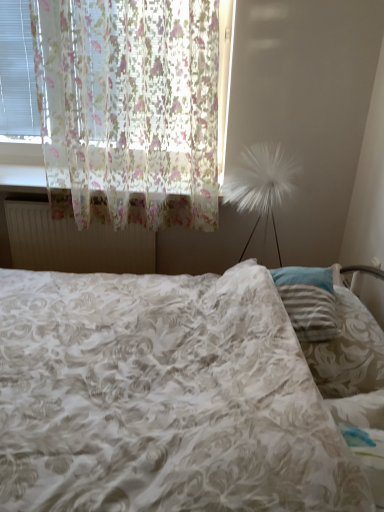
Question: Does white fluffy lamp at right have a greater height compared to translucent floral fabric at left?

Choices:
 (A) yes
 (B) no

Answer: (B)

Question: Is white fluffy lamp at right far from translucent floral fabric at left?

Choices:
 (A) no
 (B) yes

Answer: (A)

Question: From the image's perspective, would you say white fluffy lamp at right is shown under translucent floral fabric at left?

Choices:
 (A) no
 (B) yes

Answer: (B)

Question: Is white fluffy lamp at right outside translucent floral fabric at left?

Choices:
 (A) yes
 (B) no

Answer: (A)

Question: Is white fluffy lamp at right smaller than translucent floral fabric at left?

Choices:
 (A) yes
 (B) no

Answer: (A)

Question: Does white fluffy lamp at right have a lesser height compared to translucent floral fabric at left?

Choices:
 (A) yes
 (B) no

Answer: (A)

Question: Can you confirm if floral fabric bed at center is thinner than white fluffy lamp at right?

Choices:
 (A) yes
 (B) no

Answer: (B)

Question: Is floral fabric bed at center far from white fluffy lamp at right?

Choices:
 (A) no
 (B) yes

Answer: (B)

Question: Is floral fabric bed at center oriented away from white fluffy lamp at right?

Choices:
 (A) yes
 (B) no

Answer: (B)

Question: Is floral fabric bed at center aimed at white fluffy lamp at right?

Choices:
 (A) no
 (B) yes

Answer: (A)

Question: From a real-world perspective, is floral fabric bed at center on top of white fluffy lamp at right?

Choices:
 (A) yes
 (B) no

Answer: (B)

Question: Is floral fabric bed at center bigger than white fluffy lamp at right?

Choices:
 (A) no
 (B) yes

Answer: (B)

Question: Is white fluffy lamp at right at the back of translucent floral fabric at left?

Choices:
 (A) yes
 (B) no

Answer: (B)